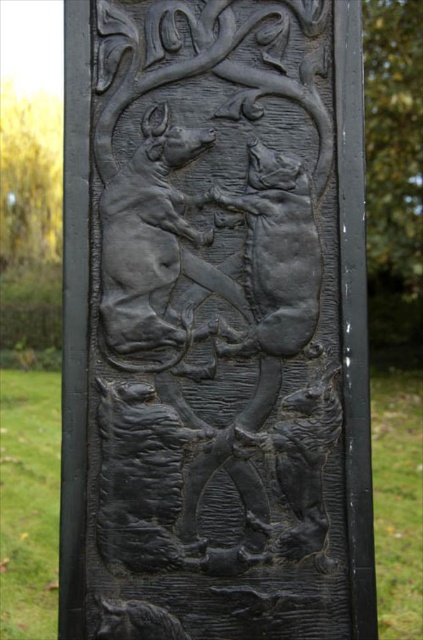
Question: Among these points, which one is farthest from the camera?

Choices:
 (A) (200, 545)
 (B) (392, 38)
 (C) (38, 211)

Answer: (C)

Question: Can you confirm if black matte relief at center is positioned above green leafy tree at upper right?

Choices:
 (A) yes
 (B) no

Answer: (B)

Question: Estimate the real-world distances between objects in this image. Which object is farther from the black matte relief at center?

Choices:
 (A) yellow-green leaves at upper left
 (B) green leafy tree at upper right

Answer: (A)

Question: Considering the relative positions of green leafy tree at upper right and yellow-green leaves at upper left in the image provided, where is green leafy tree at upper right located with respect to yellow-green leaves at upper left?

Choices:
 (A) right
 (B) left

Answer: (A)

Question: Which of the following is the closest to the observer?

Choices:
 (A) green leafy tree at upper right
 (B) yellow-green leaves at upper left

Answer: (A)

Question: Is black matte relief at center closer to camera compared to green leafy tree at upper right?

Choices:
 (A) no
 (B) yes

Answer: (B)